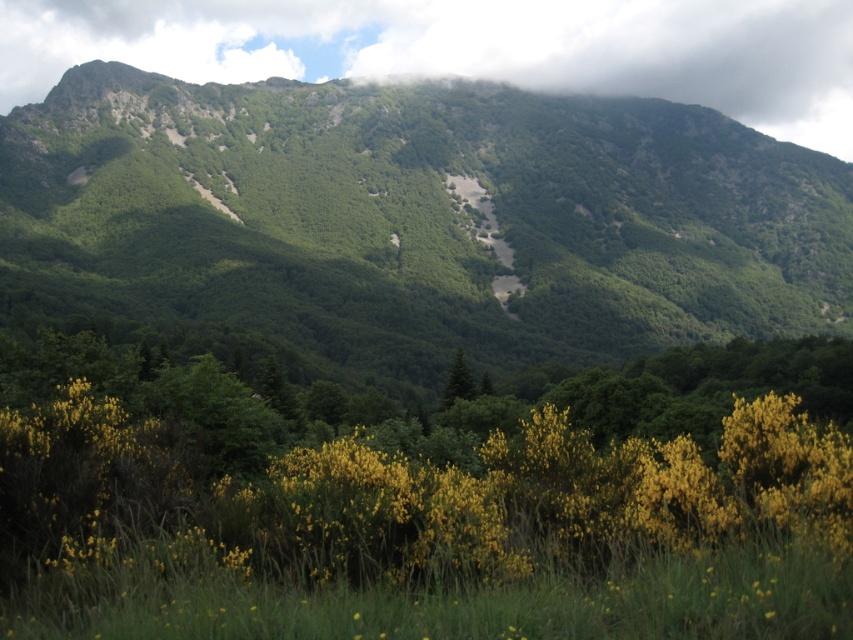
You are a hiker standing at the starting point of the dirt path in the valley. You want to reach the white fluffy cloud at upper center marked by point [637,54]. Which direction should you head towards?

The white fluffy cloud at upper center marked by point [637,54] is located in the upper center of the image, so you should head upwards or towards the sky to reach it. However, since clouds are in the sky, you cannot physically reach them.